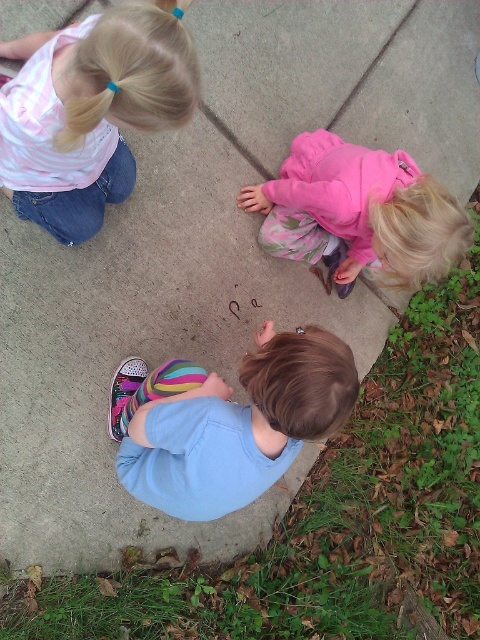
Between blue cotton shirt at lower center and pink fleece jacket at lower right, which one has less height?

Standing shorter between the two is blue cotton shirt at lower center.

Can you confirm if blue cotton shirt at lower center is wider than pink fleece jacket at lower right?

Correct, the width of blue cotton shirt at lower center exceeds that of pink fleece jacket at lower right.

Identify the location of blue cotton shirt at lower center. pyautogui.click(x=239, y=426).

Locate an element on the screen. This screenshot has width=480, height=640. blue cotton shirt at lower center is located at coordinates (239, 426).

Between striped cotton shirt at upper left and blue cotton shirt at lower center, which one has less height?

Standing shorter between the two is striped cotton shirt at upper left.

Is striped cotton shirt at upper left to the left of blue cotton shirt at lower center from the viewer's perspective?

Correct, you'll find striped cotton shirt at upper left to the left of blue cotton shirt at lower center.

Image resolution: width=480 pixels, height=640 pixels. What do you see at coordinates (90, 113) in the screenshot? I see `striped cotton shirt at upper left` at bounding box center [90, 113].

This screenshot has width=480, height=640. In order to click on striped cotton shirt at upper left in this screenshot , I will do `click(90, 113)`.

Between striped cotton shirt at upper left and pink fleece jacket at lower right, which one is positioned higher?

striped cotton shirt at upper left is above.

Between striped cotton shirt at upper left and pink fleece jacket at lower right, which one appears on the right side from the viewer's perspective?

Positioned to the right is pink fleece jacket at lower right.

Is point (82, 184) farther from viewer compared to point (249, 189)?

That is False.

Locate an element on the screen. striped cotton shirt at upper left is located at coordinates (90, 113).